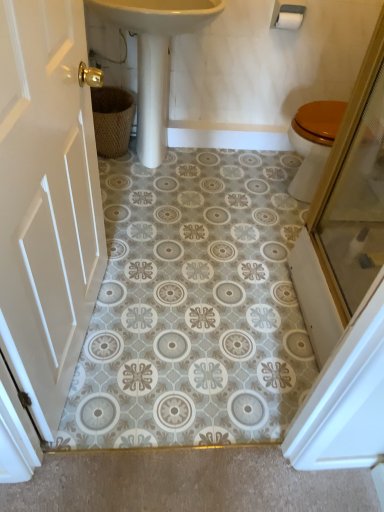
Question: From the image's perspective, is white wood door at left located above or below white glossy sink at center?

Choices:
 (A) below
 (B) above

Answer: (A)

Question: Looking at their shapes, would you say white wood door at left is wider or thinner than white glossy sink at center?

Choices:
 (A) thin
 (B) wide

Answer: (A)

Question: Estimate the real-world distances between objects in this image. Which object is farther from the white wood door at left?

Choices:
 (A) woven brown basket at left
 (B) white matte toilet paper at upper right
 (C) white glossy sink at center

Answer: (B)

Question: Considering the real-world distances, which object is farthest from the white matte toilet paper at upper right?

Choices:
 (A) woven brown basket at left
 (B) white glossy sink at center
 (C) white wood door at left

Answer: (C)